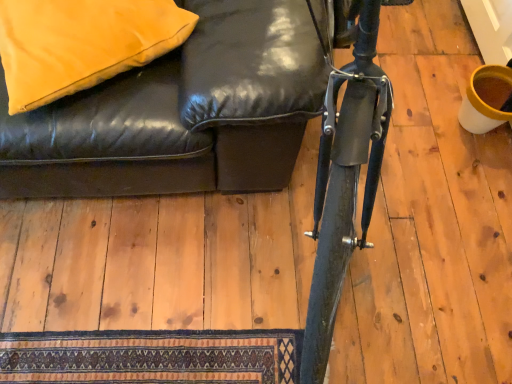
I want to click on velvet yellow pillow at upper left, so click(x=81, y=43).

What is the approximate width of velvet yellow pillow at upper left?

The width of velvet yellow pillow at upper left is 15.64 inches.

The image size is (512, 384). Describe the element at coordinates (81, 43) in the screenshot. I see `velvet yellow pillow at upper left` at that location.

What are the coordinates of `velvet yellow pillow at upper left` in the screenshot? It's located at [x=81, y=43].